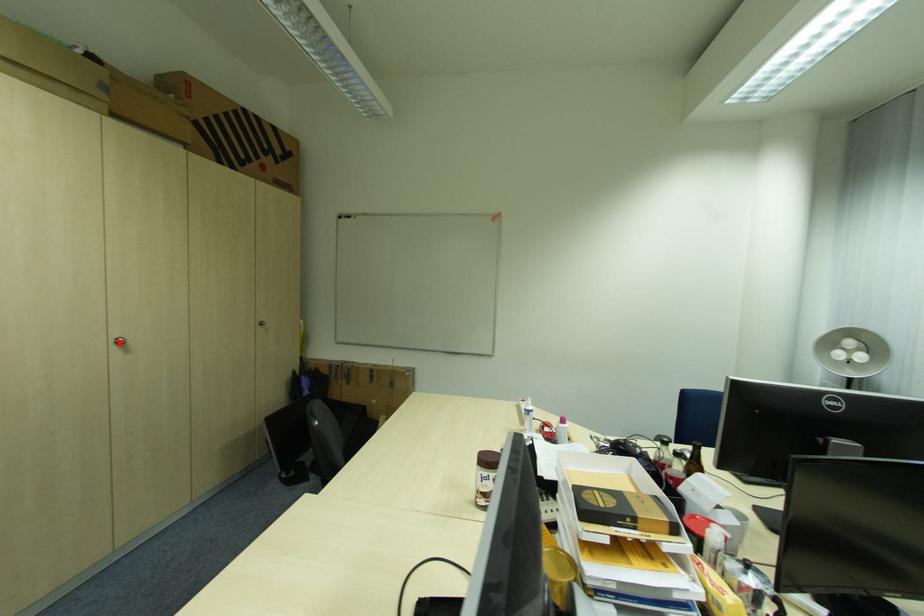
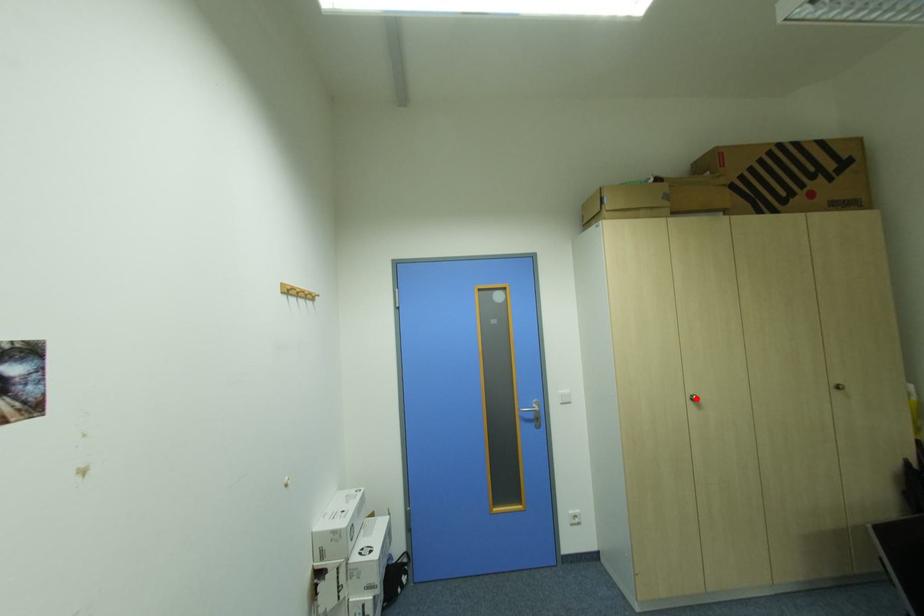
I am providing you with two images of the same scene from different viewpoints. A red point is marked on the first image and another point is marked on the second image. Does the point marked in image1 correspond to the same location as the one in image2?

Yes